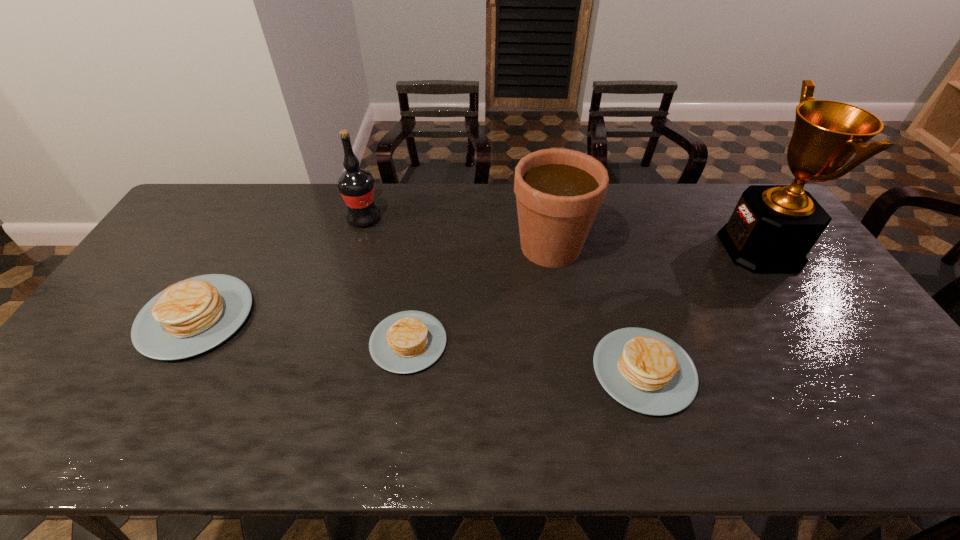
At what (x,y) coordinates should I click in order to perform the action: click on the leftmost object. Please return your answer as a coordinate pair (x, y). This screenshot has width=960, height=540. Looking at the image, I should click on (192, 316).

This screenshot has width=960, height=540. What are the coordinates of `the third shortest object` in the screenshot? It's located at (192, 316).

Image resolution: width=960 pixels, height=540 pixels. What are the coordinates of `the fourth object from right to left` in the screenshot? It's located at (406, 342).

Locate an element on the screen. the shortest object is located at coordinates (406, 342).

The height and width of the screenshot is (540, 960). What are the coordinates of `the second shortest object` in the screenshot? It's located at tap(645, 371).

Find the location of `the rightmost pancake`. the rightmost pancake is located at coordinates (645, 371).

Locate an element on the screen. flowerpot is located at coordinates (558, 192).

Identify the location of trophy cup. (772, 229).

The height and width of the screenshot is (540, 960). What are the coordinates of `the rightmost object` in the screenshot? It's located at (772, 229).

Where is `wine bottle`? The height and width of the screenshot is (540, 960). wine bottle is located at coordinates (356, 186).